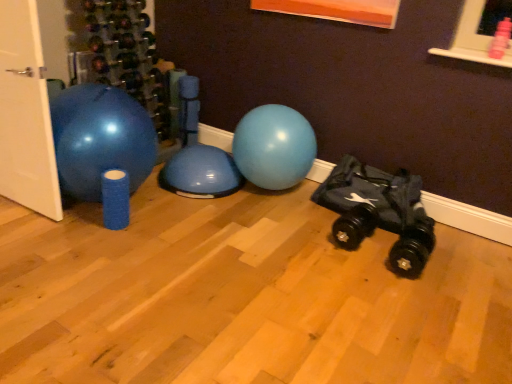
What do you see at coordinates (25, 114) in the screenshot? The width and height of the screenshot is (512, 384). I see `white matte door at left` at bounding box center [25, 114].

Find the location of `white matte door at left`. white matte door at left is located at coordinates (25, 114).

Where is `black fabric baby carriage at lower right`? This screenshot has height=384, width=512. black fabric baby carriage at lower right is located at coordinates (379, 212).

What do you see at coordinates (379, 212) in the screenshot? Image resolution: width=512 pixels, height=384 pixels. I see `black fabric baby carriage at lower right` at bounding box center [379, 212].

Locate an element on the screen. Image resolution: width=512 pixels, height=384 pixels. white matte door at left is located at coordinates (25, 114).

Is white matte door at left at the right side of black fabric baby carriage at lower right?

No.

Which object is further away from the camera, white matte door at left or black fabric baby carriage at lower right?

black fabric baby carriage at lower right is further from the camera.

Considering the positions of point (41, 189) and point (374, 193), is point (41, 189) closer or farther from the camera than point (374, 193)?

Point (41, 189) appears to be closer to the viewer than point (374, 193).

From the image's perspective, which is below, white matte door at left or black fabric baby carriage at lower right?

black fabric baby carriage at lower right is shown below in the image.

Looking at this image, from a real-world perspective, which is physically above, white matte door at left or black fabric baby carriage at lower right?

From a 3D spatial view, white matte door at left is above.

Can you confirm if white matte door at left is thinner than black fabric baby carriage at lower right?

Indeed, white matte door at left has a lesser width compared to black fabric baby carriage at lower right.

Considering the sizes of objects white matte door at left and black fabric baby carriage at lower right in the image provided, who is taller, white matte door at left or black fabric baby carriage at lower right?

With more height is white matte door at left.

Is white matte door at left bigger or smaller than black fabric baby carriage at lower right?

white matte door at left is bigger than black fabric baby carriage at lower right.

In the scene shown: Is black fabric baby carriage at lower right located within white matte door at left?

No, black fabric baby carriage at lower right is not surrounded by white matte door at left.

Is white matte door at left positioned far away from black fabric baby carriage at lower right?

Yes, white matte door at left and black fabric baby carriage at lower right are located far from each other.

From the picture: Is white matte door at left turned away from black fabric baby carriage at lower right?

No, white matte door at left's orientation is not away from black fabric baby carriage at lower right.

Can you tell me how much white matte door at left and black fabric baby carriage at lower right differ in facing direction?

There is a 2.52-degree angle between the facing directions of white matte door at left and black fabric baby carriage at lower right.

Locate an element on the screen. baby carriage that appears below the white matte door at left (from a real-world perspective) is located at coordinates (379, 212).

Is black fabric baby carriage at lower right to the left or to the right of white matte door at left in the image?

In the image, black fabric baby carriage at lower right appears on the right side of white matte door at left.

Considering their positions, is black fabric baby carriage at lower right located in front of or behind white matte door at left?

black fabric baby carriage at lower right is behind white matte door at left.

Is point (353, 233) positioned in front of point (54, 150)?

No, it is behind (54, 150).

From the image's perspective, is black fabric baby carriage at lower right located beneath white matte door at left?

Yes, from the image's perspective, black fabric baby carriage at lower right is beneath white matte door at left.

From a real-world perspective, is black fabric baby carriage at lower right physically located above or below white matte door at left?

Clearly, from a real-world perspective, black fabric baby carriage at lower right is below white matte door at left.

Can you confirm if black fabric baby carriage at lower right is thinner than white matte door at left?

No.

Can you confirm if black fabric baby carriage at lower right is taller than white matte door at left?

No, black fabric baby carriage at lower right is not taller than white matte door at left.

Can you confirm if black fabric baby carriage at lower right is smaller than white matte door at left?

Indeed, black fabric baby carriage at lower right has a smaller size compared to white matte door at left.

Do you think black fabric baby carriage at lower right is within white matte door at left, or outside of it?

black fabric baby carriage at lower right exists outside the volume of white matte door at left.

Would you say black fabric baby carriage at lower right is a long distance from white matte door at left?

Absolutely, black fabric baby carriage at lower right is distant from white matte door at left.

Is black fabric baby carriage at lower right facing towards white matte door at left?

No, black fabric baby carriage at lower right is not turned towards white matte door at left.

From the picture: How far apart are black fabric baby carriage at lower right and white matte door at left?

black fabric baby carriage at lower right is 1.83 meters from white matte door at left.

This screenshot has width=512, height=384. In the image, there is a white matte door at left. Find the location of `baby carriage below it (from the image's perspective)`. baby carriage below it (from the image's perspective) is located at coordinates (379, 212).

Where is `door in front of the black fabric baby carriage at lower right`? door in front of the black fabric baby carriage at lower right is located at coordinates (25, 114).

In the image, there is a black fabric baby carriage at lower right. In order to click on door above it (from the image's perspective) in this screenshot , I will do `click(25, 114)`.